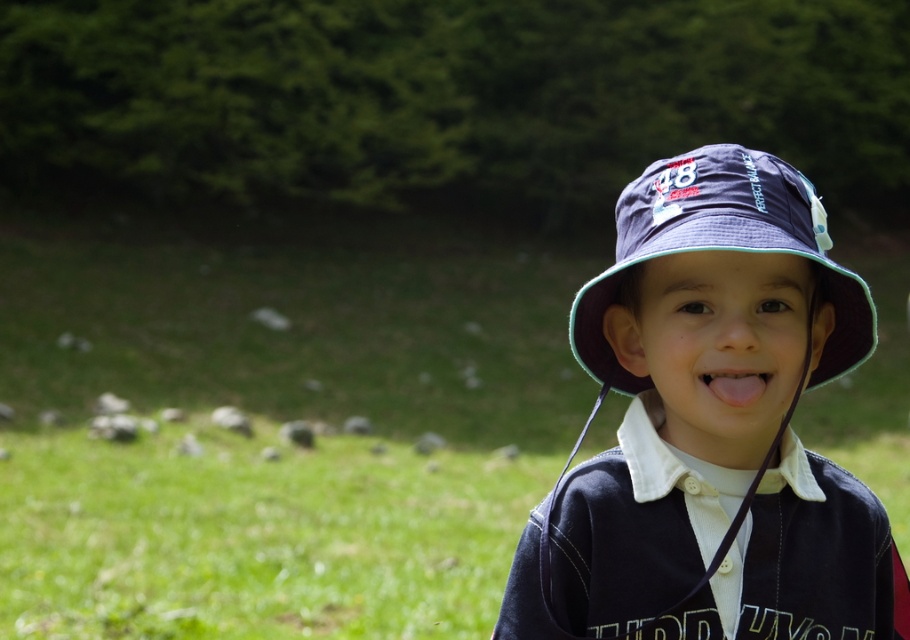
Can you confirm if green grass at center is positioned to the left of navy blue fabric baseball hat at center?

In fact, green grass at center is to the right of navy blue fabric baseball hat at center.

Does green grass at center have a lesser height compared to navy blue fabric baseball hat at center?

In fact, green grass at center may be taller than navy blue fabric baseball hat at center.

The width and height of the screenshot is (910, 640). Identify the location of green grass at center. (275, 435).

Does point (359, 352) lie behind point (830, 598)?

Yes, it is behind point (830, 598).

Does green grass at center have a greater height compared to matte blue hat at center?

Indeed, green grass at center has a greater height compared to matte blue hat at center.

Identify the location of green grass at center. This screenshot has height=640, width=910. pyautogui.click(x=275, y=435).

Can you confirm if matte blue hat at center is positioned to the left of pink flesh-colored tongue at center?

Indeed, matte blue hat at center is positioned on the left side of pink flesh-colored tongue at center.

What do you see at coordinates (713, 426) in the screenshot? The height and width of the screenshot is (640, 910). I see `matte blue hat at center` at bounding box center [713, 426].

I want to click on matte blue hat at center, so click(713, 426).

This screenshot has height=640, width=910. I want to click on matte blue hat at center, so point(713,426).